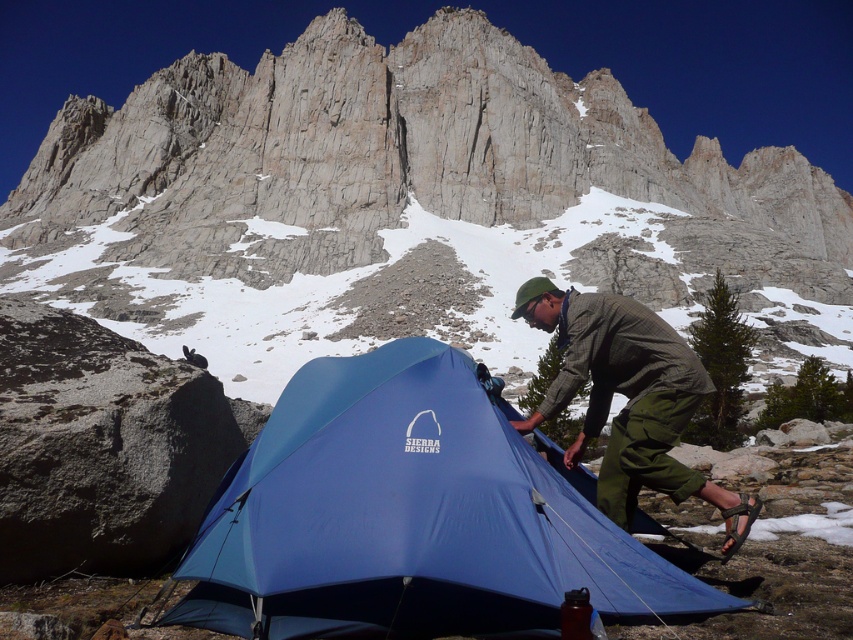
Looking at this image, you are a hiker who just arrived at the campsite and need to set up your gear. Where is the blue nylon tent at center located in the image?

The blue nylon tent at center is located at point [410,515] in the image.

You are a hiker who just arrived at the campsite. You need to set up your gear. Which item is located lower in the scene, the blue nylon tent at center or the green plaid shirt at center?

The blue nylon tent at center is located lower than the green plaid shirt at center according to the description.